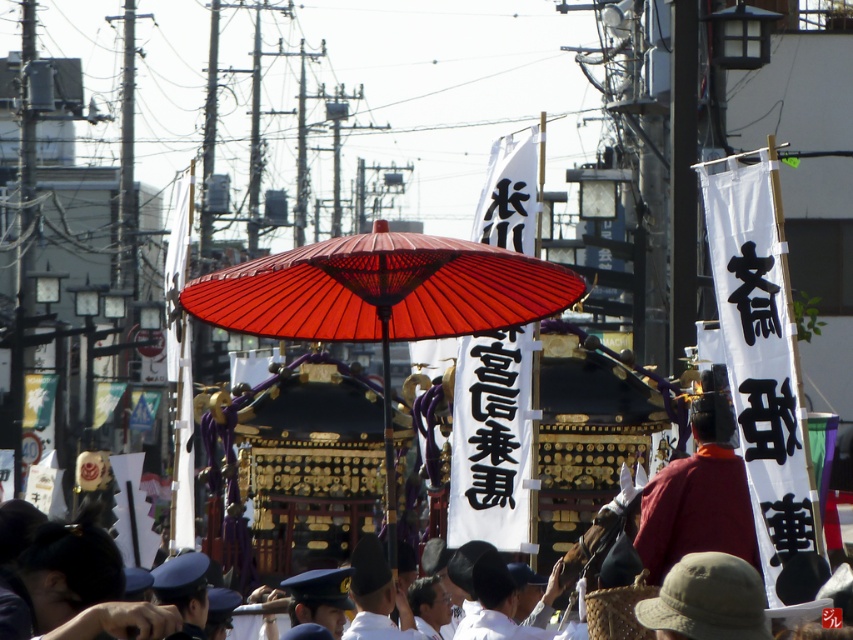
You are standing at the festival and want to take a photo of the portable shrine. The camera you have can only focus on objects within 100 meters. Is the point at coordinates point (556, 305) within the camera focus range?

The point at coordinates point (556, 305) is 111.96 meters away from the viewer, which is beyond the camera focus range of 100 meters. Therefore, the camera cannot focus on this point.

You are a photographer at the festival and want to capture both the matte red parasol at center and the red velvet hat at center in a single shot. Since the parasol is above the hat, how should you adjust your camera angle to ensure both are fully visible?

The matte red parasol at center is located above the red velvet hat at center. To capture both in a single shot, you should angle your camera upward to include the parasol above while keeping the hat in the lower part of the frame.

You are standing in the middle of the festival procession and want to take a photo. There are two points of interest marked in the scene. The first is at point (372, 268) and the second is at point (660, 502). Which point is closer to you?

Point (372, 268) is closer to the camera than point (660, 502).